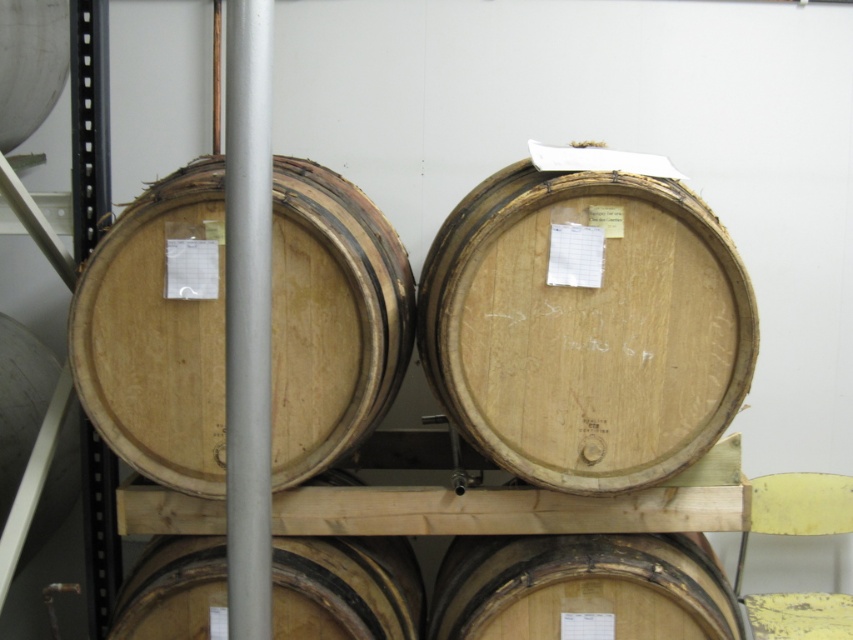
Question: Can you confirm if natural wood barrel at left is positioned to the right of wooden barrel at lower center?

Choices:
 (A) yes
 (B) no

Answer: (B)

Question: Which point is farther from the camera taking this photo?

Choices:
 (A) (531, 547)
 (B) (334, 264)

Answer: (A)

Question: Is natural wood barrel at left positioned at the back of natural wood barrel at lower center?

Choices:
 (A) no
 (B) yes

Answer: (A)

Question: Considering the relative positions of natural wood barrel at center and wooden barrel at lower center in the image provided, where is natural wood barrel at center located with respect to wooden barrel at lower center?

Choices:
 (A) below
 (B) above

Answer: (B)

Question: Estimate the real-world distances between objects in this image. Which object is farther from the natural wood barrel at center?

Choices:
 (A) natural wood barrel at lower center
 (B) natural wood barrel at left

Answer: (A)

Question: Estimate the real-world distances between objects in this image. Which object is farther from the natural wood barrel at center?

Choices:
 (A) natural wood barrel at lower center
 (B) wooden barrel at lower center
 (C) natural wood barrel at left

Answer: (A)